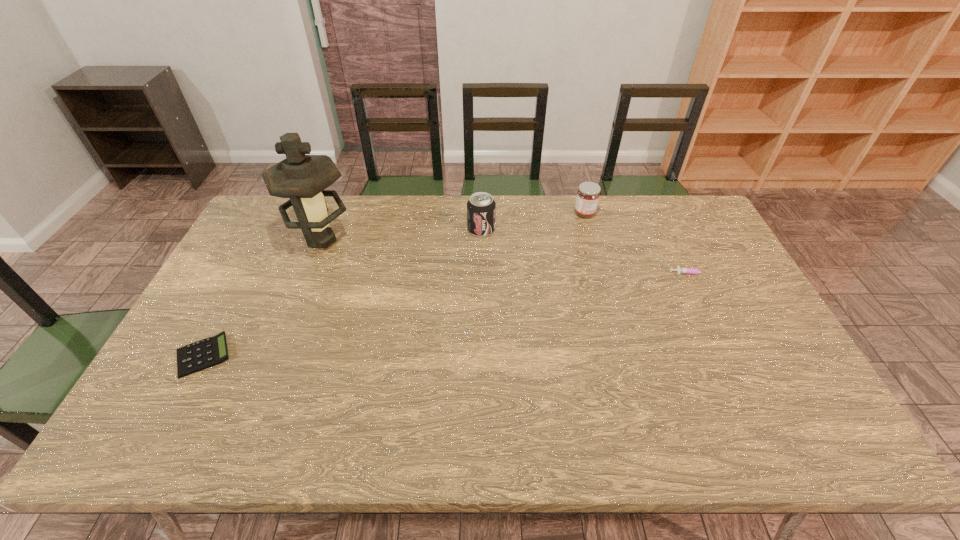
At what (x,y) coordinates should I click in order to perform the action: click on empty space between the rightmost object and the soda can. Please return your answer as a coordinate pair (x, y). Looking at the image, I should click on (587, 251).

You are a GUI agent. You are given a task and a screenshot of the screen. Output one action in this format:
    pyautogui.click(x=<x>, y=<y>)
    Task: Click on the free area in between the nearest object and the soda can
    The width and height of the screenshot is (960, 540).
    Given the screenshot: What is the action you would take?
    pyautogui.click(x=343, y=293)

The width and height of the screenshot is (960, 540). I want to click on vacant space in between the calculator and the tallest object, so click(x=263, y=298).

Find the location of `unoccupied area between the syringe and the tallest object`. unoccupied area between the syringe and the tallest object is located at coordinates (507, 256).

Select which object is the fourth closest to the farthest object. Please provide its 2D coordinates. Your answer should be formatted as a tuple, i.e. [(x, y)], where the tuple contains the x and y coordinates of a point satisfying the conditions above.

[(209, 352)]

Locate an element on the screen. object that stands as the fourth closest to the farthest object is located at coordinates (209, 352).

In order to click on vacant space that satisfies the following two spatial constraints: 1. on the back side of the oil lamp; 2. on the right side of the shortest object in this screenshot , I will do `click(265, 240)`.

At what (x,y) coordinates should I click in order to perform the action: click on free space that satisfies the following two spatial constraints: 1. on the back side of the calculator; 2. on the left side of the soda can. Please return your answer as a coordinate pair (x, y). This screenshot has width=960, height=540. Looking at the image, I should click on (271, 230).